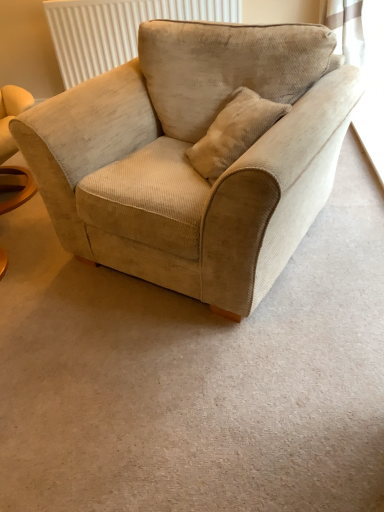
Question: Is white textured radiator at upper center bigger than beige corduroy armchair at center?

Choices:
 (A) yes
 (B) no

Answer: (B)

Question: Is white textured radiator at upper center oriented towards beige corduroy armchair at center?

Choices:
 (A) no
 (B) yes

Answer: (B)

Question: Can you confirm if white textured radiator at upper center is smaller than beige corduroy armchair at center?

Choices:
 (A) no
 (B) yes

Answer: (B)

Question: Is beige corduroy armchair at center inside white textured radiator at upper center?

Choices:
 (A) no
 (B) yes

Answer: (A)

Question: Is white textured radiator at upper center in front of beige corduroy armchair at center?

Choices:
 (A) no
 (B) yes

Answer: (A)

Question: Are white textured radiator at upper center and beige corduroy armchair at center far apart?

Choices:
 (A) yes
 (B) no

Answer: (A)

Question: Would you consider beige corduroy armchair at center to be distant from white textured radiator at upper center?

Choices:
 (A) no
 (B) yes

Answer: (B)

Question: Is the position of beige corduroy armchair at center less distant than that of white textured radiator at upper center?

Choices:
 (A) yes
 (B) no

Answer: (A)

Question: Is beige corduroy armchair at center positioned behind white textured radiator at upper center?

Choices:
 (A) no
 (B) yes

Answer: (A)

Question: Considering the relative sizes of beige corduroy armchair at center and white textured radiator at upper center in the image provided, is beige corduroy armchair at center shorter than white textured radiator at upper center?

Choices:
 (A) yes
 (B) no

Answer: (B)

Question: Can you confirm if beige corduroy armchair at center is bigger than white textured radiator at upper center?

Choices:
 (A) yes
 (B) no

Answer: (A)

Question: From a real-world perspective, is beige corduroy armchair at center physically above white textured radiator at upper center?

Choices:
 (A) no
 (B) yes

Answer: (A)

Question: Visually, is beige corduroy armchair at center positioned to the left or to the right of white textured radiator at upper center?

Choices:
 (A) right
 (B) left

Answer: (A)